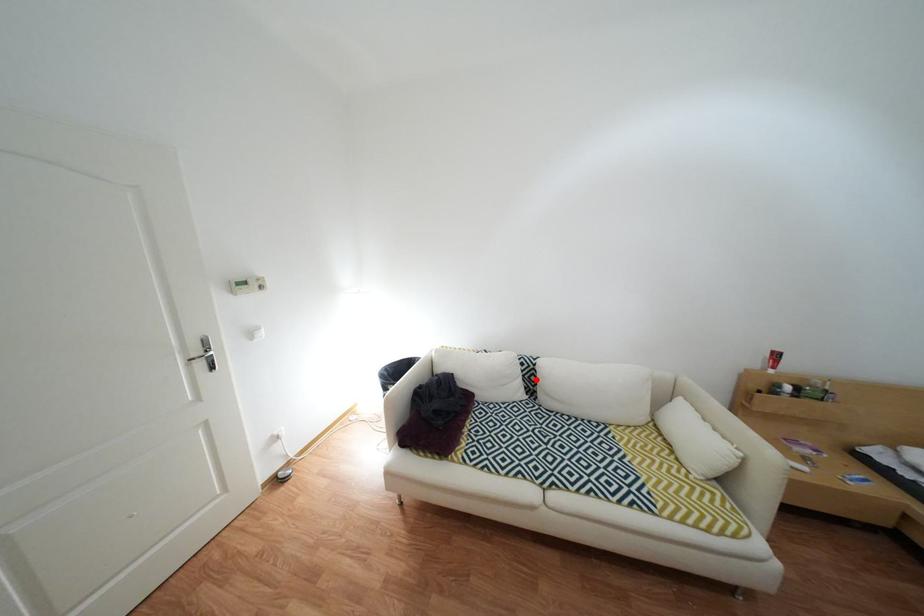
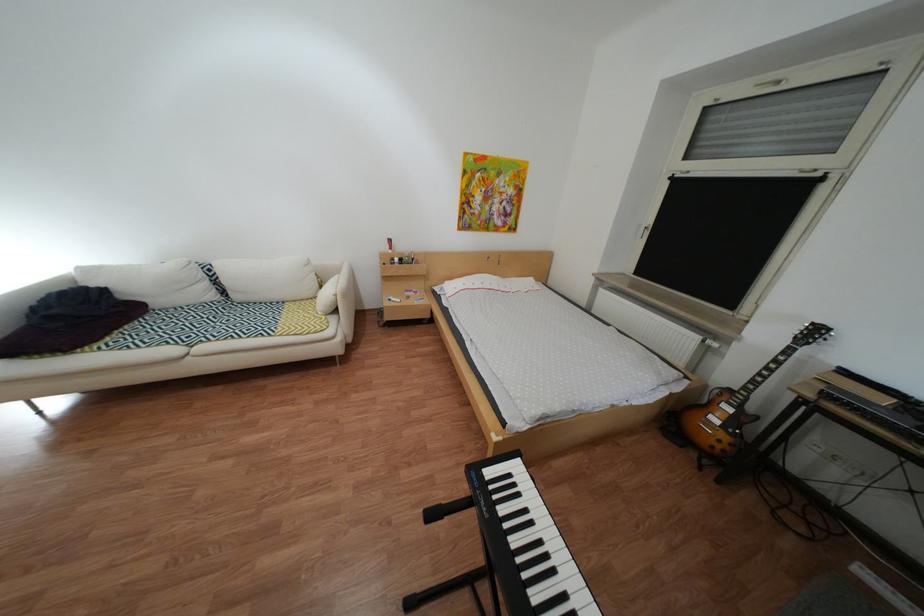
Question: I am providing you with two images of the same scene from different viewpoints. Image1 has a red point marked. In image2, the corresponding 3D location appears at what relative position? Reply with the corresponding letter.

Choices:
 (A) Closer
 (B) Farther

Answer: (A)